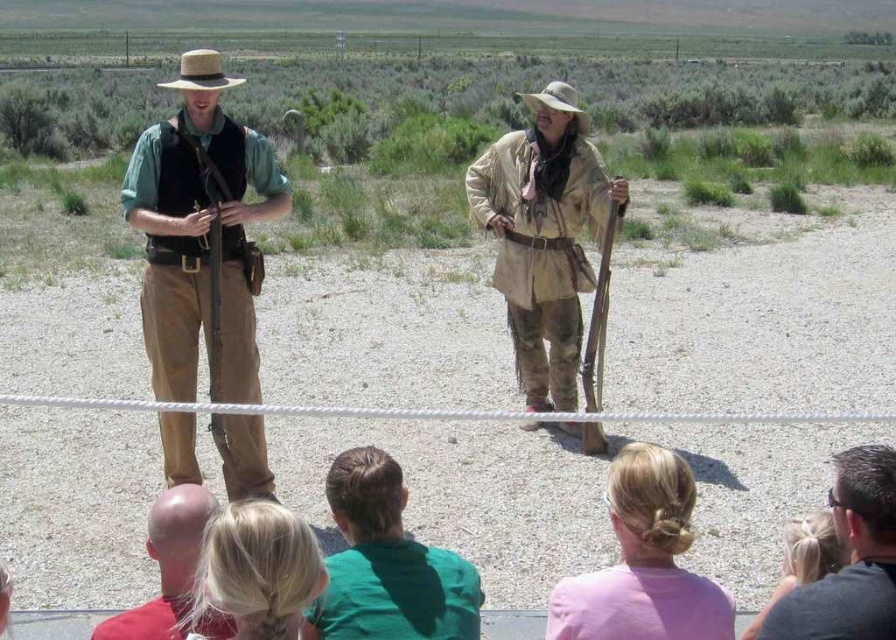
Question: Is matte green shirt at center in front of wooden rifle at center?

Choices:
 (A) yes
 (B) no

Answer: (A)

Question: Which of the following is the closest to the observer?

Choices:
 (A) (228, 520)
 (B) (649, 490)
 (C) (833, 620)
 (D) (214, 508)

Answer: (A)

Question: Which of the following is the closest to the observer?

Choices:
 (A) (428, 586)
 (B) (140, 461)
 (C) (200, 81)
 (D) (162, 577)

Answer: (D)

Question: Does bald head at lower left come in front of blonde hair at upper center?

Choices:
 (A) yes
 (B) no

Answer: (A)

Question: Does matte green shirt at center appear over pink fabric hair bun at lower center?

Choices:
 (A) yes
 (B) no

Answer: (A)

Question: Which of the following is the closest to the observer?

Choices:
 (A) blonde hair at lower center
 (B) matte green shirt at center
 (C) bald head at lower left

Answer: (A)